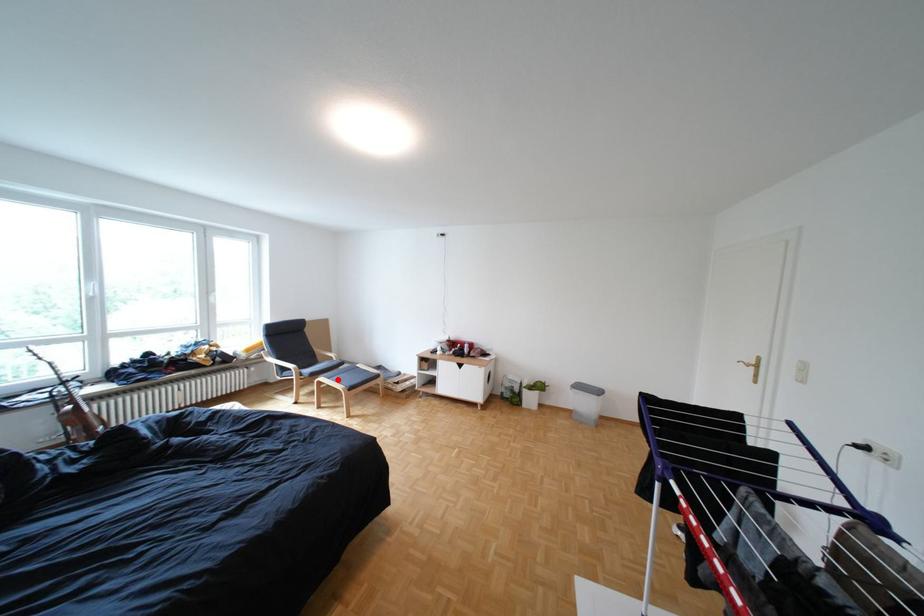
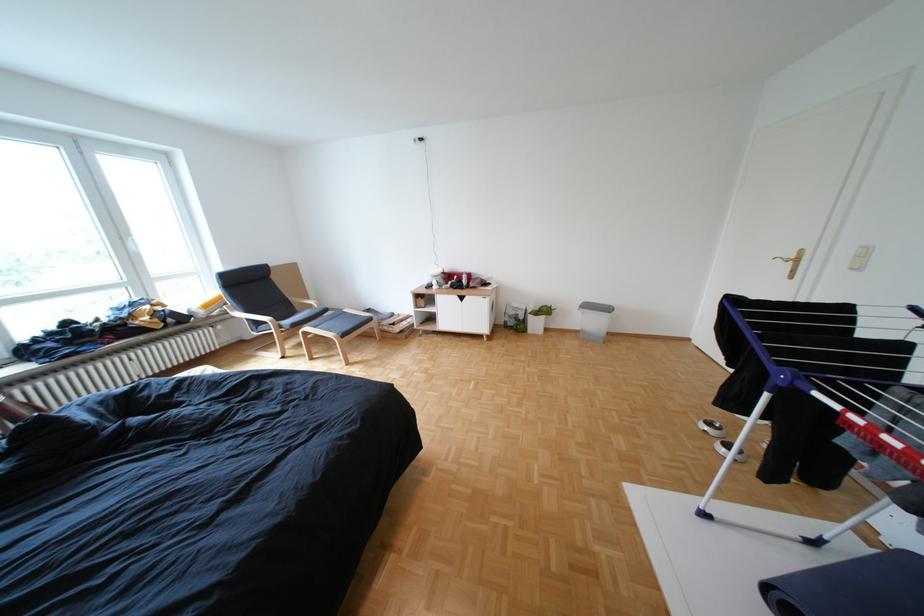
Locate, in the second image, the point that corresponds to the highlighted location in the first image.

(322, 329)